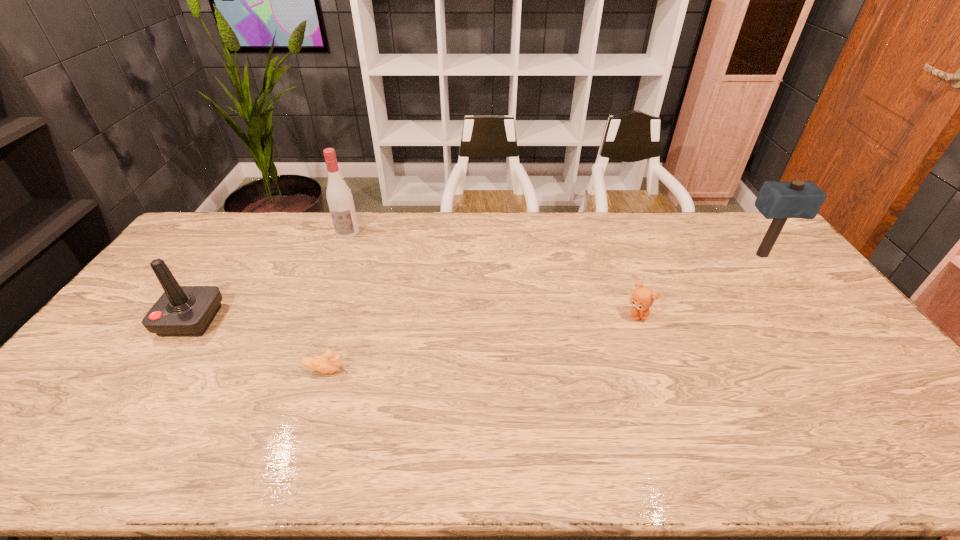
In the image, there is a desktop. Identify the location of vacant space at the near edge. The height and width of the screenshot is (540, 960). (635, 468).

Find the location of a particular element. Image resolution: width=960 pixels, height=540 pixels. vacant space at the left edge of the desktop is located at coordinates (215, 262).

The image size is (960, 540). In order to click on vacant space at the right edge in this screenshot , I will do `click(834, 349)`.

In the image, there is a desktop. Where is `vacant space at the far left corner`? vacant space at the far left corner is located at coordinates (203, 241).

The height and width of the screenshot is (540, 960). What are the coordinates of `vacant space at the near right corner of the desktop` in the screenshot? It's located at (926, 451).

You are a GUI agent. You are given a task and a screenshot of the screen. Output one action in this format:
    pyautogui.click(x=<x>, y=<y>)
    Task: Click on the vacant area that lies between the joystick and the alcohol
    The width and height of the screenshot is (960, 540).
    Given the screenshot: What is the action you would take?
    pyautogui.click(x=270, y=276)

Identify the location of vacant region between the alcohol and the mallet. 554,244.

Where is `free area in between the fourth object from left to right and the second farthest object`? This screenshot has width=960, height=540. free area in between the fourth object from left to right and the second farthest object is located at coordinates (699, 285).

The image size is (960, 540). In order to click on free space that is in between the mallet and the joystick in this screenshot , I will do `click(476, 288)`.

This screenshot has width=960, height=540. I want to click on free space that is in between the rightmost object and the farthest object, so click(x=554, y=244).